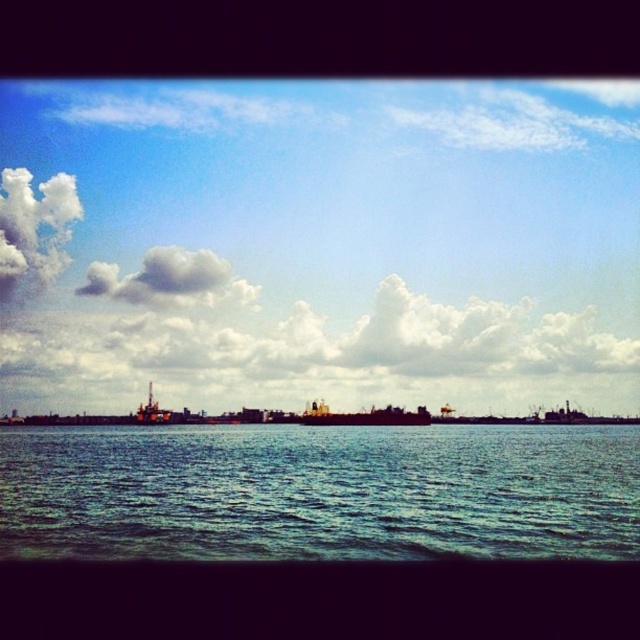
Can you confirm if blue water at center is positioned to the right of white fluffy cloud at upper center?

Yes, blue water at center is to the right of white fluffy cloud at upper center.

Is blue water at center above white fluffy cloud at upper center?

No.

Is point (620, 464) behind point (113, 264)?

No, it is in front of (113, 264).

This screenshot has width=640, height=640. I want to click on blue water at center, so [320, 492].

This screenshot has width=640, height=640. I want to click on blue sky at upper center, so click(x=320, y=243).

Between blue sky at upper center and blue water at center, which one is positioned lower?

blue water at center

Does point (540, 129) come closer to viewer compared to point (284, 442)?

That is False.

Locate an element on the screen. The height and width of the screenshot is (640, 640). blue sky at upper center is located at coordinates (320, 243).

Describe the element at coordinates (170, 280) in the screenshot. I see `white fluffy cloud at upper center` at that location.

Does white fluffy cloud at upper center have a greater width compared to dark gray metallic ship at center?

Indeed, white fluffy cloud at upper center has a greater width compared to dark gray metallic ship at center.

Is point (148, 253) positioned in front of point (401, 412)?

No.

Where is `white fluffy cloud at upper center`? The image size is (640, 640). white fluffy cloud at upper center is located at coordinates (170, 280).